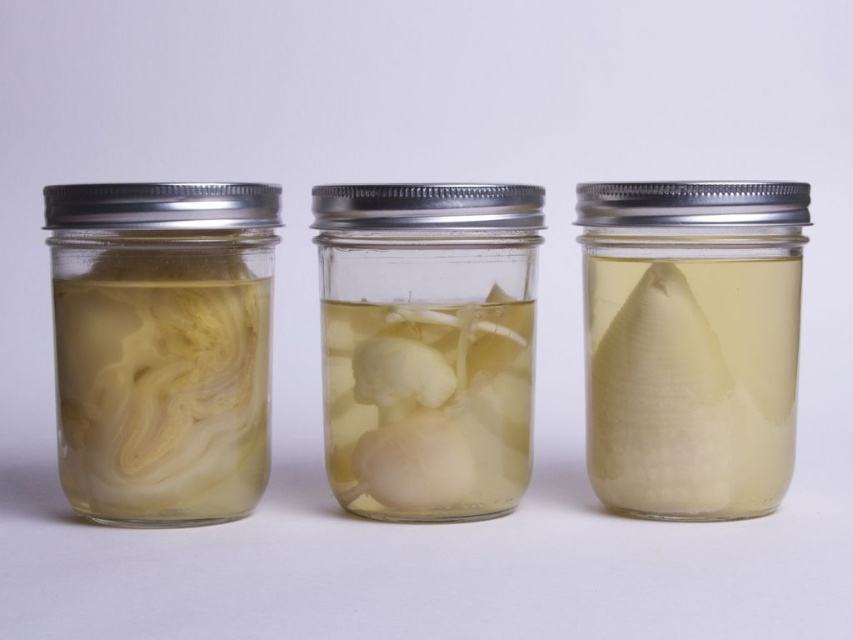
You are a food preservation expert examining the jars. You need to determine which object in the center is taller between the translucent glass cone at center and the translucent white mushrooms at center. Which one is taller?

The translucent glass cone at center is taller than the translucent white mushrooms at center according to the description.

Looking at the jars, you see the translucent glass cone at center and the translucent white mushrooms at center. Which one is positioned to the right?

The translucent glass cone at center is to the right of the translucent white mushrooms at center.

You are standing in front of the three jars. A point at coordinate (735, 465) is 96.78 centimeters away from you. If you want to reach that point, which jar should you move towards?

The point at coordinate (735, 465) is 96.78 centimeters from the camera, so you should move towards the jar that is located at that coordinate. Since the jars are arranged from left to right, the point likely corresponds to the rightmost jar, as coordinates often increase from left to right and bottom to top. However, without specific jar coordinates, the exact jar cannot be determined. The answer is based on the given distance and coordinate system assumptions.